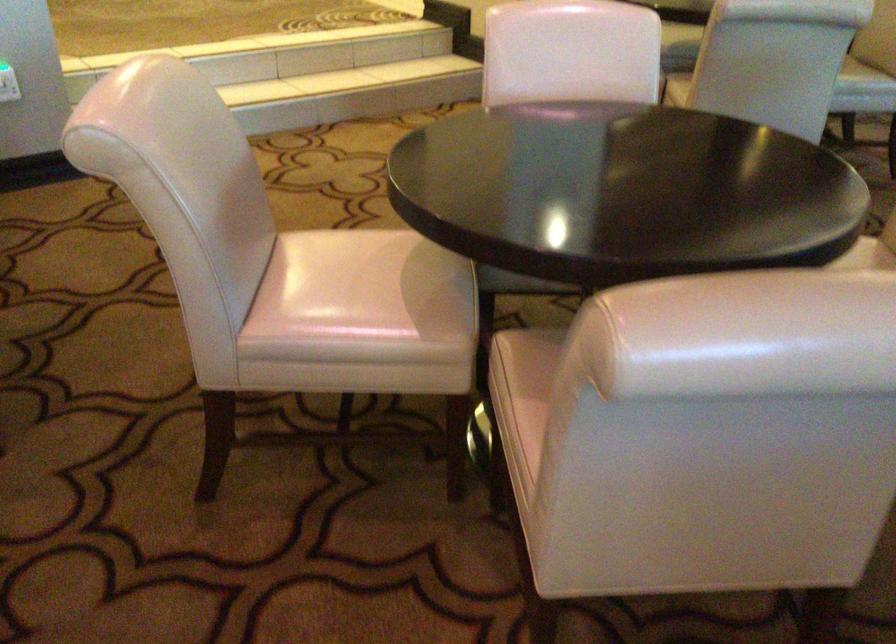
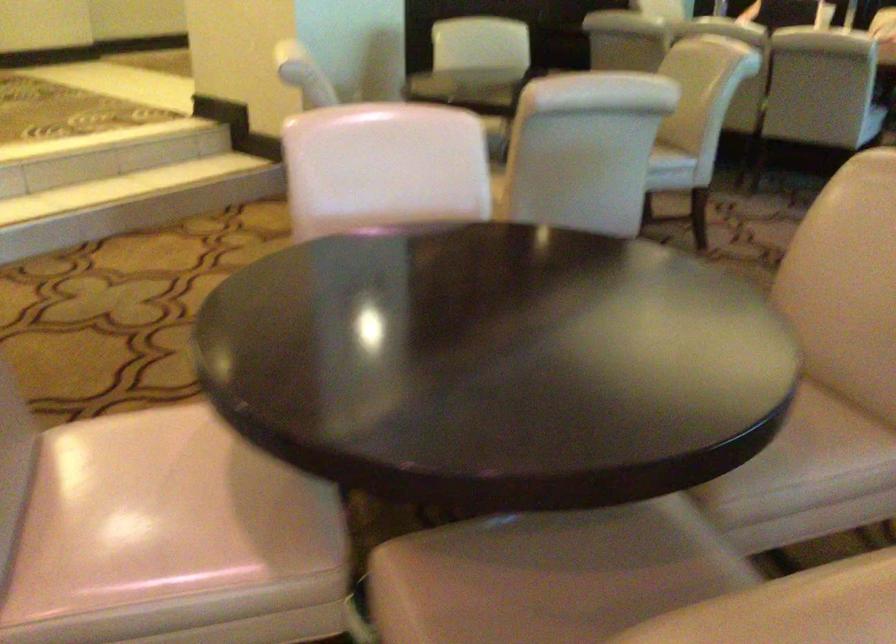
Question: Based on the continuous images, in which direction is the camera rotating? Reply with the corresponding letter.

Choices:
 (A) Left
 (B) Right
 (C) Up
 (D) Down

Answer: (B)